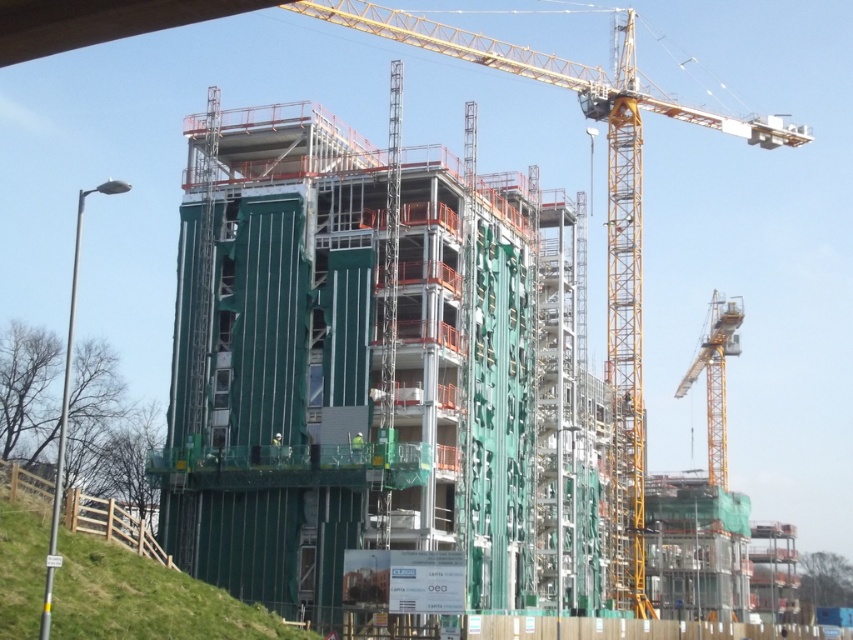
Who is positioned more to the right, yellow metallic crane at upper center or green grass at lower left?

From the viewer's perspective, yellow metallic crane at upper center appears more on the right side.

Is yellow metallic crane at upper center to the left of green grass at lower left from the viewer's perspective?

In fact, yellow metallic crane at upper center is to the right of green grass at lower left.

The width and height of the screenshot is (853, 640). Find the location of `yellow metallic crane at upper center`. yellow metallic crane at upper center is located at coordinates (606, 221).

What are the coordinates of `yellow metallic crane at upper center` in the screenshot? It's located at (606, 221).

In the scene shown: Can you confirm if green grass at lower left is positioned to the left of yellow metallic crane at right?

Correct, you'll find green grass at lower left to the left of yellow metallic crane at right.

What do you see at coordinates (146, 600) in the screenshot? This screenshot has width=853, height=640. I see `green grass at lower left` at bounding box center [146, 600].

Who is more forward, (86, 563) or (740, 307)?

Point (86, 563) is more forward.

The width and height of the screenshot is (853, 640). Identify the location of green grass at lower left. (146, 600).

Which is more to the right, yellow metallic crane at upper center or yellow metallic crane at right?

Positioned to the right is yellow metallic crane at right.

Which is below, yellow metallic crane at upper center or yellow metallic crane at right?

yellow metallic crane at right

Locate an element on the screen. The width and height of the screenshot is (853, 640). yellow metallic crane at upper center is located at coordinates (606, 221).

Locate an element on the screen. yellow metallic crane at upper center is located at coordinates (606, 221).